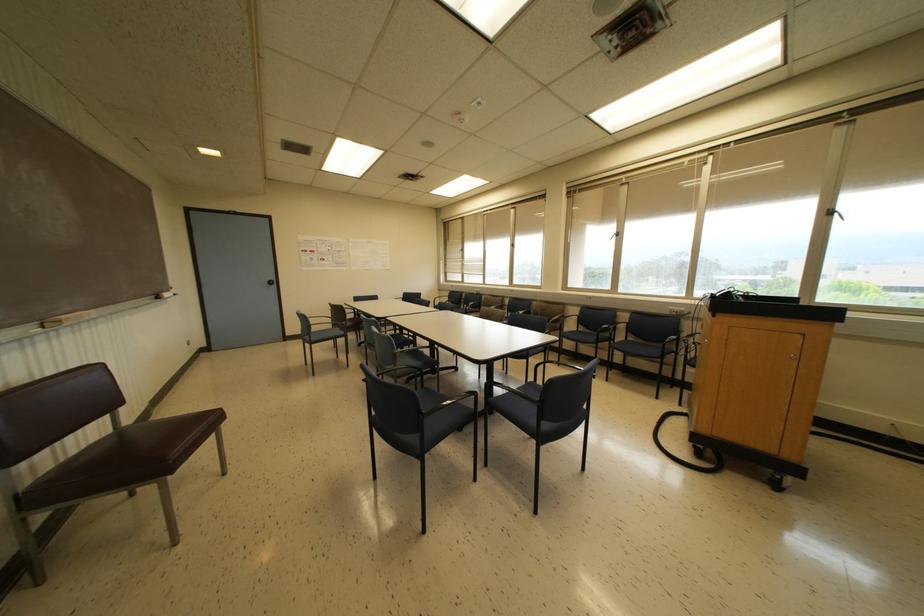
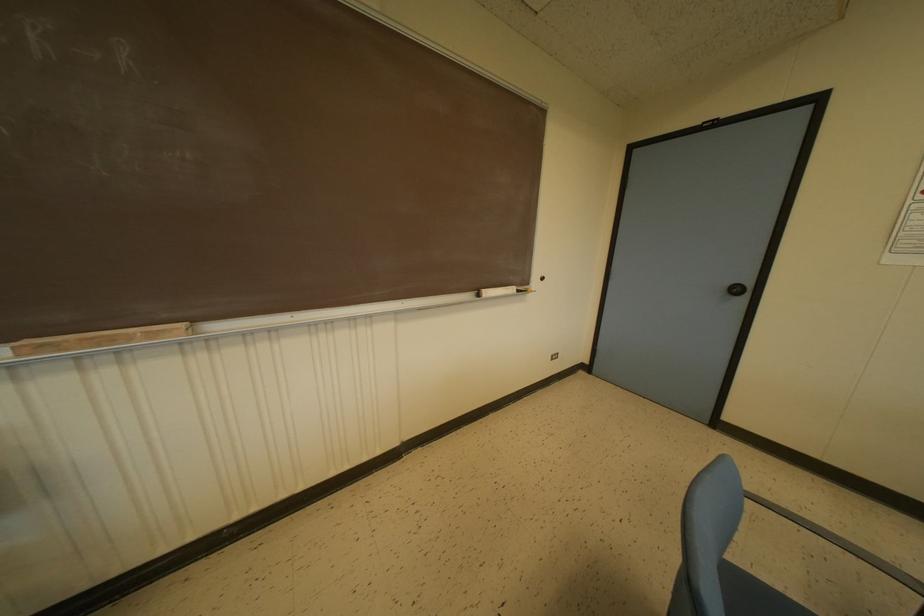
Locate, in the second image, the point that corresponds to [166,294] in the first image.

(487, 292)